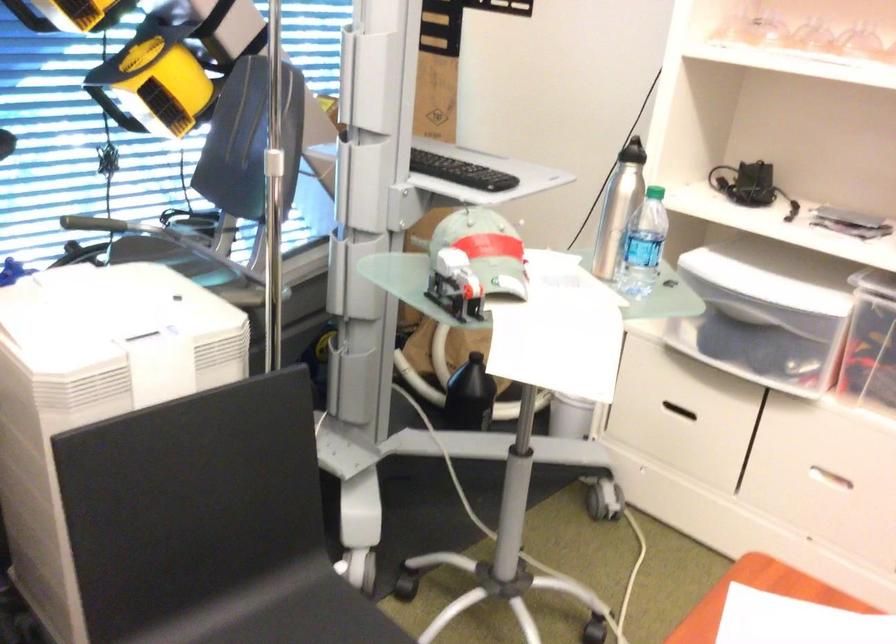
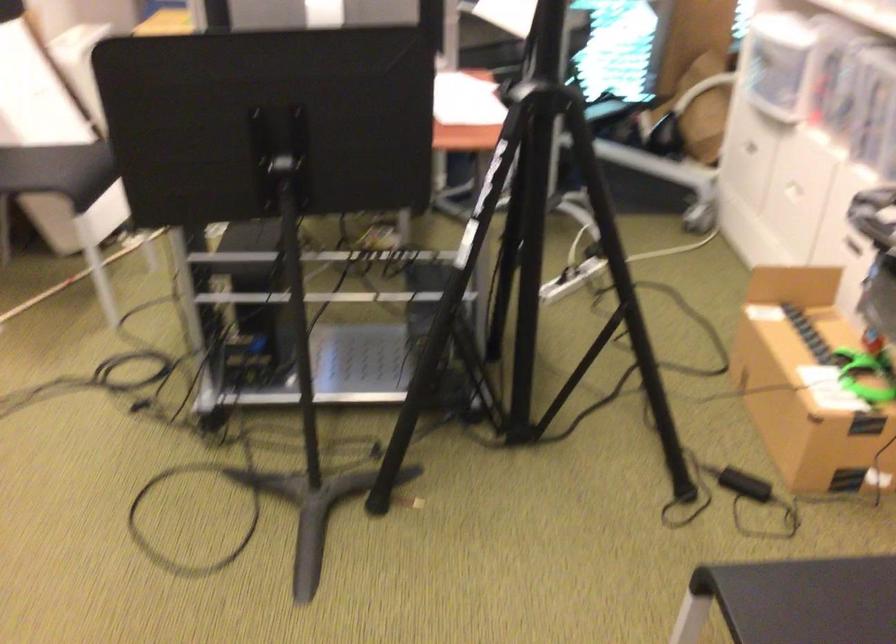
Question: I am providing you with two images of the same scene from different viewpoints. After the viewpoint changes to image2, which objects are now occluded?

Choices:
 (A) black floor fan
 (B) cardboard box
 (C) chair sitting surface
 (D) black chair sitting surface

Answer: (D)